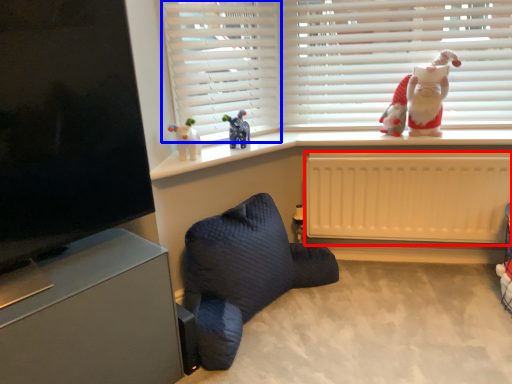
Question: Which point is further to the camera, radiator (highlighted by a red box) or curtain (highlighted by a blue box)?

Choices:
 (A) radiator
 (B) curtain

Answer: (A)